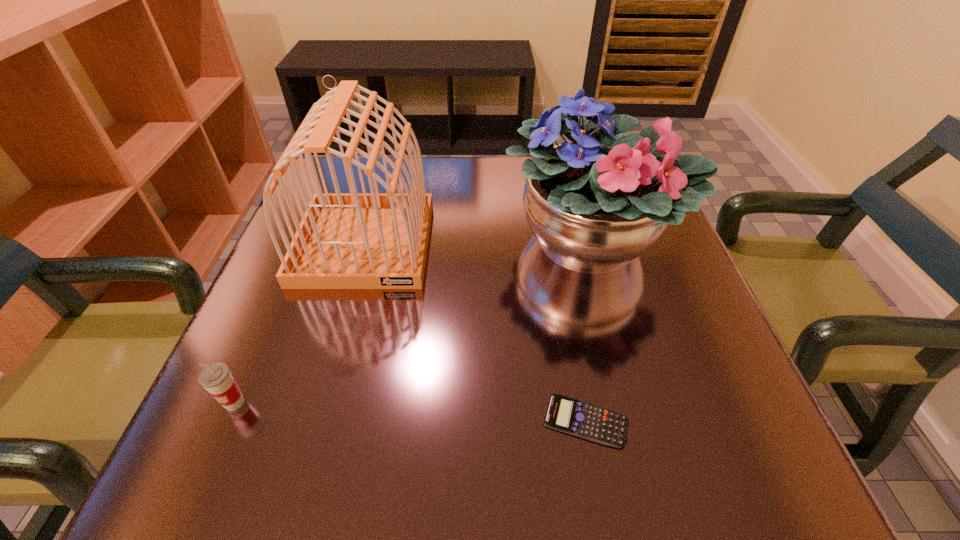
Identify the location of object that is at the near edge. The width and height of the screenshot is (960, 540). (595, 423).

You are a GUI agent. You are given a task and a screenshot of the screen. Output one action in this format:
    pyautogui.click(x=<x>, y=<y>)
    Task: Click on the birdcage that is at the left edge
    
    Given the screenshot: What is the action you would take?
    pyautogui.click(x=353, y=240)

Where is `cup that is at the left edge`? The height and width of the screenshot is (540, 960). cup that is at the left edge is located at coordinates (216, 378).

Where is `object at the right edge`? This screenshot has width=960, height=540. object at the right edge is located at coordinates (595, 204).

The height and width of the screenshot is (540, 960). Identify the location of object at the far left corner. (353, 240).

At what (x,y) coordinates should I click in order to perform the action: click on object located at the far right corner. Please return your answer as a coordinate pair (x, y). The image size is (960, 540). Looking at the image, I should click on (595, 204).

Where is `vacant space at the far edge`? This screenshot has width=960, height=540. vacant space at the far edge is located at coordinates (444, 201).

I want to click on free space at the near edge of the desktop, so click(x=422, y=458).

The height and width of the screenshot is (540, 960). Identify the location of vacant space at the left edge of the desktop. (321, 353).

Locate an element on the screen. free space at the right edge of the desktop is located at coordinates (680, 287).